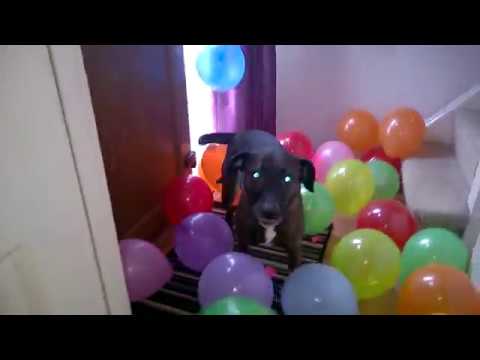
This screenshot has height=360, width=480. I want to click on hand rail, so click(x=469, y=96).